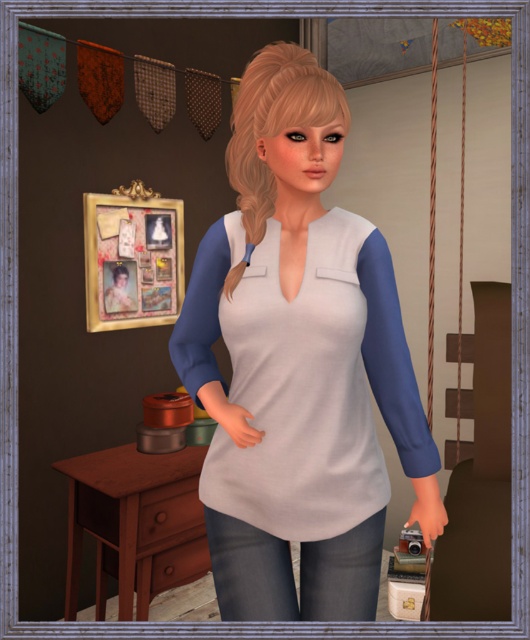
Measure the distance between matte white fabric shirt at center and white matte dress at center.

matte white fabric shirt at center is 1.72 inches from white matte dress at center.

Looking at this image, between matte white fabric shirt at center and white matte dress at center, which one is positioned lower?

Positioned lower is white matte dress at center.

Which is behind, point (310, 163) or point (322, 460)?

The point (322, 460) is behind.

You are a GUI agent. You are given a task and a screenshot of the screen. Output one action in this format:
    pyautogui.click(x=<x>, y=<y>)
    Task: Click on the matte white fabric shirt at center
    The image size is (530, 640).
    Given the screenshot: What is the action you would take?
    pyautogui.click(x=298, y=364)

Looking at this image, does matte white fabric shirt at center appear over brown wood dresser at lower left?

Yes, matte white fabric shirt at center is above brown wood dresser at lower left.

Is point (311, 451) closer to camera compared to point (171, 465)?

Yes, it is.

Which is in front, point (240, 262) or point (118, 538)?

Point (240, 262)

Where is `matte white fabric shirt at center`? matte white fabric shirt at center is located at coordinates (298, 364).

From the picture: Is the position of brown wood dresser at lower left more distant than that of denim jeans at lower center?

Yes, brown wood dresser at lower left is behind denim jeans at lower center.

Between brown wood dresser at lower left and denim jeans at lower center, which one is positioned lower?

brown wood dresser at lower left

Who is more forward, (200,506) or (308,602)?

Point (308,602)

What are the coordinates of `brown wood dresser at lower left` in the screenshot? It's located at (136, 524).